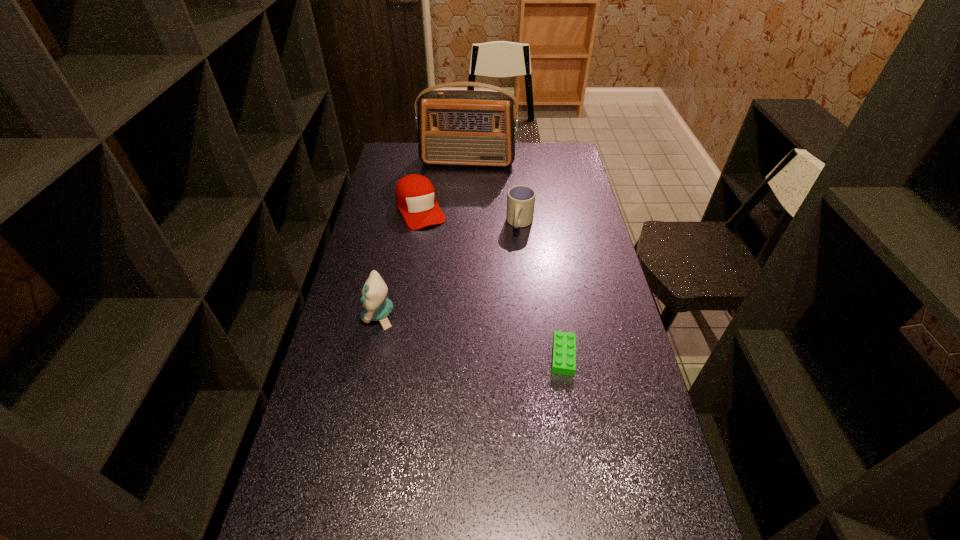
Locate an element on the screen. free space on the desktop that is between the second tallest object and the Lego and is positioned on the front-facing side of the baseball cap is located at coordinates (491, 340).

The height and width of the screenshot is (540, 960). Find the location of `free space on the desktop that is between the kitten and the shortest object and is positioned on the front-facing side of the radio receiver`. free space on the desktop that is between the kitten and the shortest object and is positioned on the front-facing side of the radio receiver is located at coordinates (443, 329).

The image size is (960, 540). In order to click on vacant spot on the desktop that is between the second nearest object and the nearest object and is positioned with the handle on the side of the cup in this screenshot , I will do `click(474, 336)`.